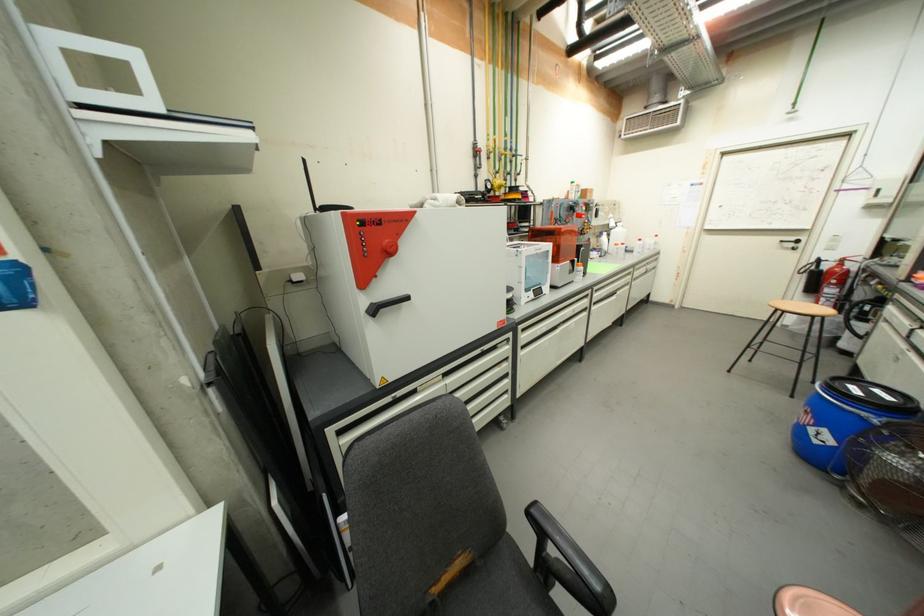
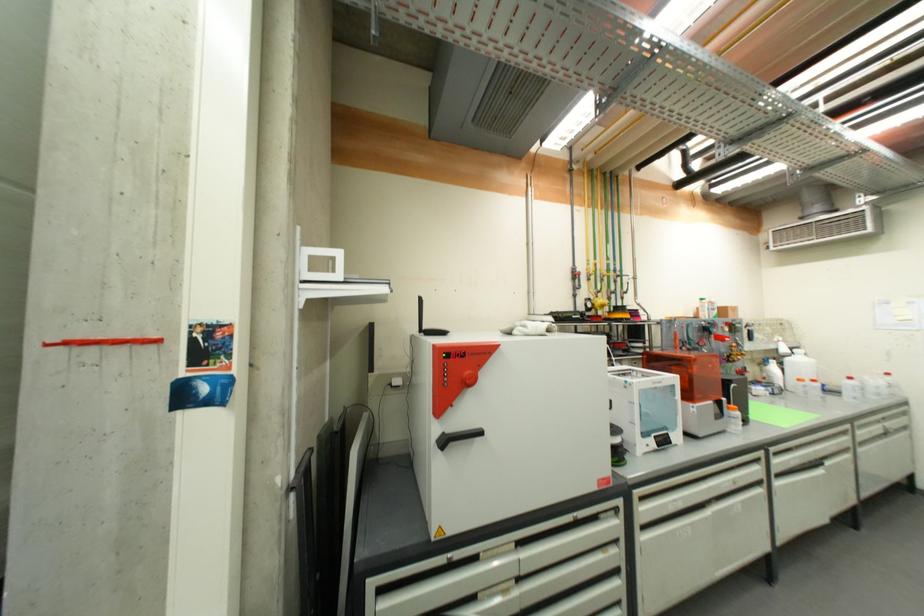
Where in the second image is the point corresponding to point 578,325 from the first image?

(745, 507)